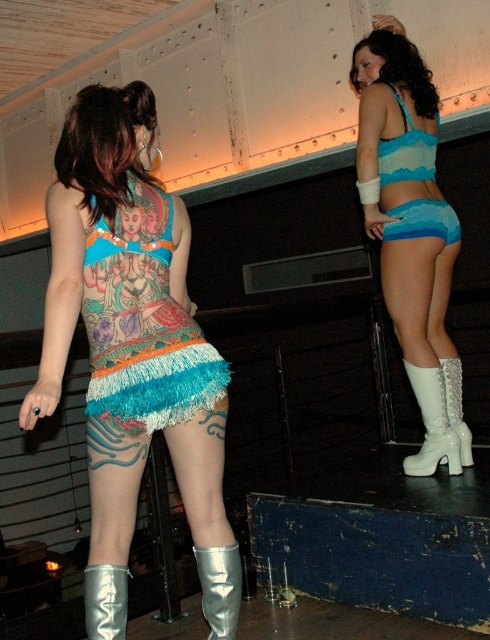
Question: Which point is farther to the camera?

Choices:
 (A) (156, 403)
 (B) (83, 109)

Answer: (B)

Question: In this image, where is shiny silver boots at center located relative to silver metallic boot at lower center?

Choices:
 (A) below
 (B) above

Answer: (B)

Question: Among these objects, which one is farthest from the camera?

Choices:
 (A) blue fabric shorts at right
 (B) white glittery boot at right
 (C) blue fabric bikini top at upper right

Answer: (B)

Question: Is turquoise fringe skirt at lower center wider than silver metallic boot at lower center?

Choices:
 (A) no
 (B) yes

Answer: (B)

Question: Does matte blue fabric bikini top at upper right have a greater width compared to silver metallic boot at lower left?

Choices:
 (A) no
 (B) yes

Answer: (B)

Question: Which is nearer to the silver metallic boot at lower left?

Choices:
 (A) white glittery boot at right
 (B) white glossy boot at right
 (C) shiny silver boots at center
 (D) turquoise fringe skirt at lower center

Answer: (C)